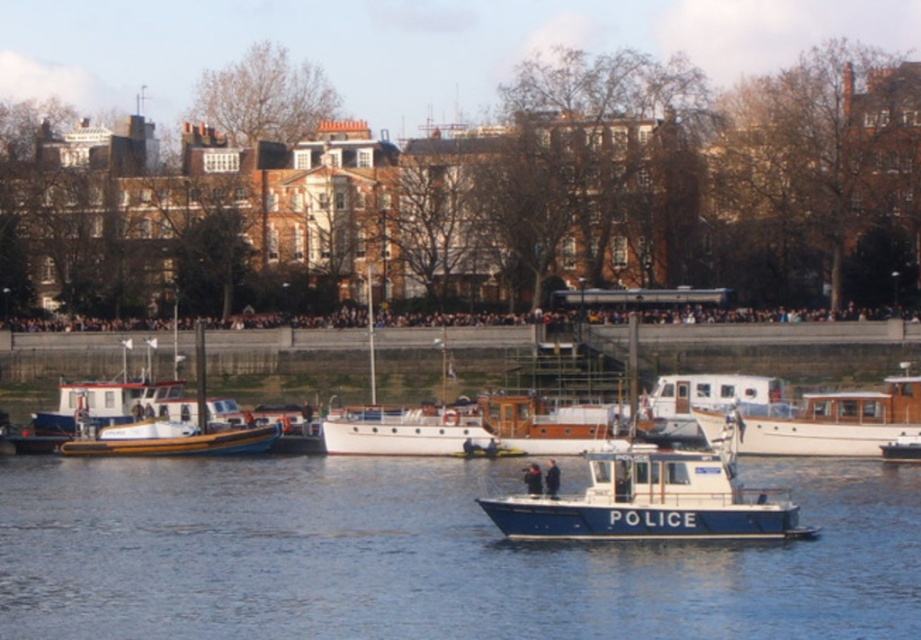
You are a photographer trying to capture both the blue polished wood police boat at center and the white polished wood boat at center in a single shot. Based on their positions, which boat should you focus on first to ensure both are in frame?

The blue polished wood police boat at center is below the white polished wood boat at center, so you should focus on the white polished wood boat at center first to ensure both are in frame.

You are a boat inspector who needs to board the blue polished wood police boat at center and the white polished wood boat at center. Based on their sizes, which boat will require a longer ladder to reach its deck?

The white polished wood boat at center requires a longer ladder because it is taller than the blue polished wood police boat at center.